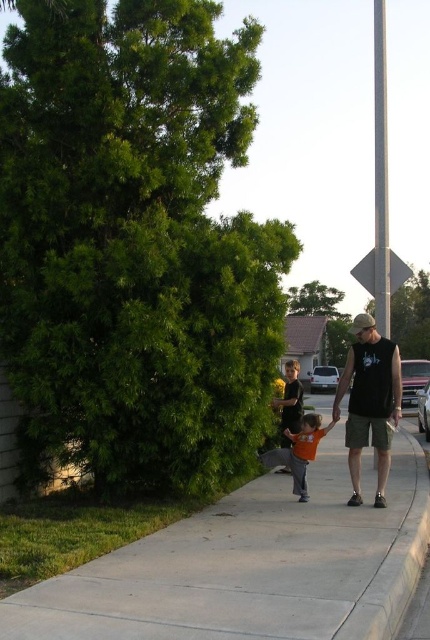
You are a drone operator trying to capture a photo of the black sleeveless shirt at center. The drone is currently hovering above the concrete sidewalk at center. Can you take the photo without moving the drone?

The concrete sidewalk at center is positioned under the black sleeveless shirt at center, so the drone can take the photo without moving since it is already above the shirt.

You are a photographer trying to capture a photo of the orange cotton shirt at center and the black matte diamond at upper right. Which object should you focus on first if you want to ensure both are in focus, considering their positions relative to the camera?

The orange cotton shirt at center has a lesser height compared to black matte diamond at upper right, so you should focus on the black matte diamond at upper right first to ensure both are in focus.

You are a photographer trying to capture a photo of the orange cotton shirt at center and the black matte diamond at upper right. Which object should you focus on first if you want to ensure both are in focus without moving the camera?

The orange cotton shirt at center is thinner than the black matte diamond at upper right, so you should focus on the black matte diamond at upper right first because it is larger and will require a smaller depth of field adjustment to include the thinner orange cotton shirt at center.